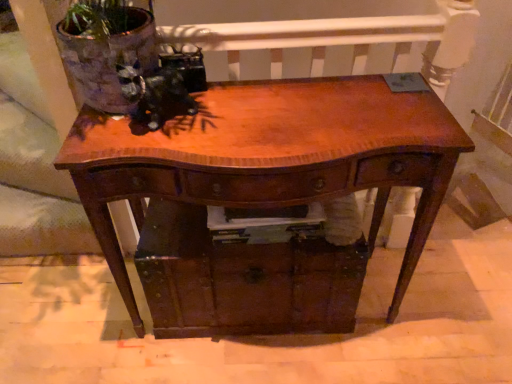
Question: Can you confirm if wooden drawer at center is wider than shiny brown wood table at center?

Choices:
 (A) yes
 (B) no

Answer: (A)

Question: From a real-world perspective, is wooden drawer at center physically above shiny brown wood table at center?

Choices:
 (A) no
 (B) yes

Answer: (A)

Question: Is wooden drawer at center positioned before shiny brown wood table at center?

Choices:
 (A) no
 (B) yes

Answer: (A)

Question: Can you confirm if wooden drawer at center is thinner than shiny brown wood table at center?

Choices:
 (A) yes
 (B) no

Answer: (B)

Question: From the image's perspective, is wooden drawer at center located beneath shiny brown wood table at center?

Choices:
 (A) yes
 (B) no

Answer: (A)

Question: Can you confirm if wooden drawer at center is shorter than shiny brown wood table at center?

Choices:
 (A) no
 (B) yes

Answer: (B)

Question: Does shiny brown wood table at center appear on the right side of wooden drawer at center?

Choices:
 (A) no
 (B) yes

Answer: (B)

Question: Is shiny brown wood table at center behind wooden drawer at center?

Choices:
 (A) no
 (B) yes

Answer: (A)

Question: Can you confirm if shiny brown wood table at center is positioned to the left of wooden drawer at center?

Choices:
 (A) yes
 (B) no

Answer: (B)

Question: Considering the relative sizes of shiny brown wood table at center and wooden drawer at center in the image provided, is shiny brown wood table at center bigger than wooden drawer at center?

Choices:
 (A) yes
 (B) no

Answer: (A)

Question: Is shiny brown wood table at center aimed at wooden drawer at center?

Choices:
 (A) yes
 (B) no

Answer: (A)

Question: Is shiny brown wood table at center shorter than wooden drawer at center?

Choices:
 (A) no
 (B) yes

Answer: (A)

Question: From a real-world perspective, is shiny brown wood table at center positioned above or below wooden drawer at center?

Choices:
 (A) above
 (B) below

Answer: (A)